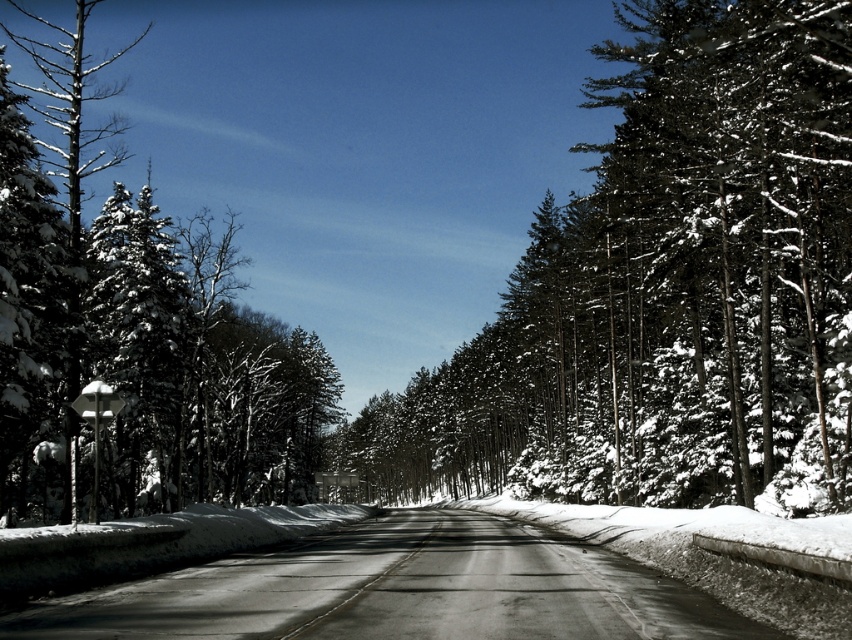
Image resolution: width=852 pixels, height=640 pixels. Identify the location of snow-covered evergreen trees at center. (665, 284).

Is snow-covered evergreen trees at center shorter than snow-covered evergreen at left?

Yes, snow-covered evergreen trees at center is shorter than snow-covered evergreen at left.

Is point (602, 371) in front of point (59, 472)?

No.

Locate an element on the screen. Image resolution: width=852 pixels, height=640 pixels. snow-covered evergreen trees at center is located at coordinates (665, 284).